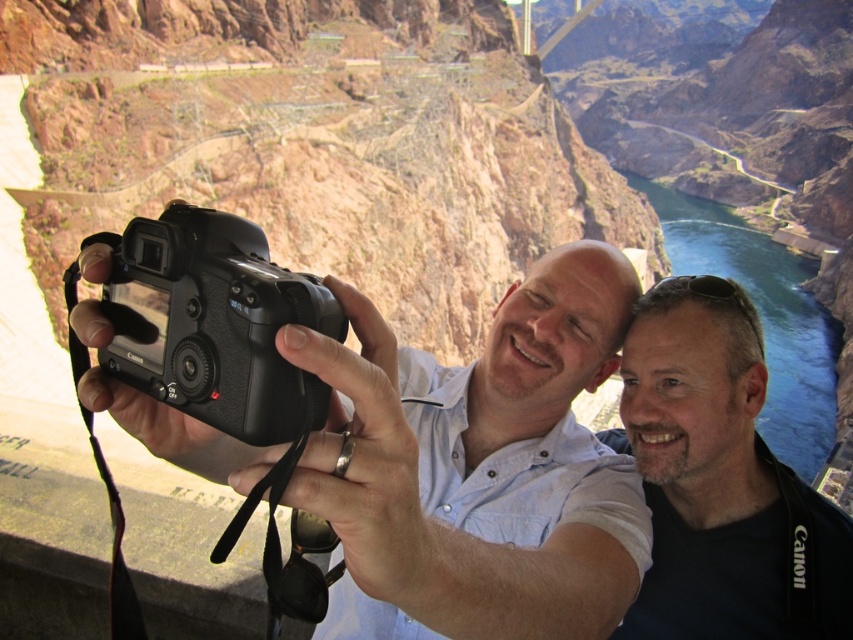
Does black matte camera at center have a greater width compared to black plastic camera at center?

Indeed, black matte camera at center has a greater width compared to black plastic camera at center.

Between black matte camera at center and black plastic camera at center, which one appears on the right side from the viewer's perspective?

Positioned to the right is black matte camera at center.

Is point (572, 372) positioned before point (315, 397)?

No, it is not.

The height and width of the screenshot is (640, 853). Identify the location of black matte camera at center. (479, 467).

How distant is black matte camera at center from dark blue t-shirt at center?

The distance of black matte camera at center from dark blue t-shirt at center is 25.92 feet.

Does black matte camera at center appear on the left side of dark blue t-shirt at center?

Yes, black matte camera at center is to the left of dark blue t-shirt at center.

Which is behind, point (646, 563) or point (706, 282)?

The point (706, 282) is behind.

At what (x,y) coordinates should I click in order to perform the action: click on black matte camera at center. Please return your answer as a coordinate pair (x, y). This screenshot has width=853, height=640. Looking at the image, I should click on (479, 467).

Which is above, dark blue t-shirt at center or black plastic camera at center?

Positioned higher is black plastic camera at center.

Which of these two, dark blue t-shirt at center or black plastic camera at center, stands shorter?

With less height is black plastic camera at center.

Where is `dark blue t-shirt at center`? The height and width of the screenshot is (640, 853). dark blue t-shirt at center is located at coordinates (720, 481).